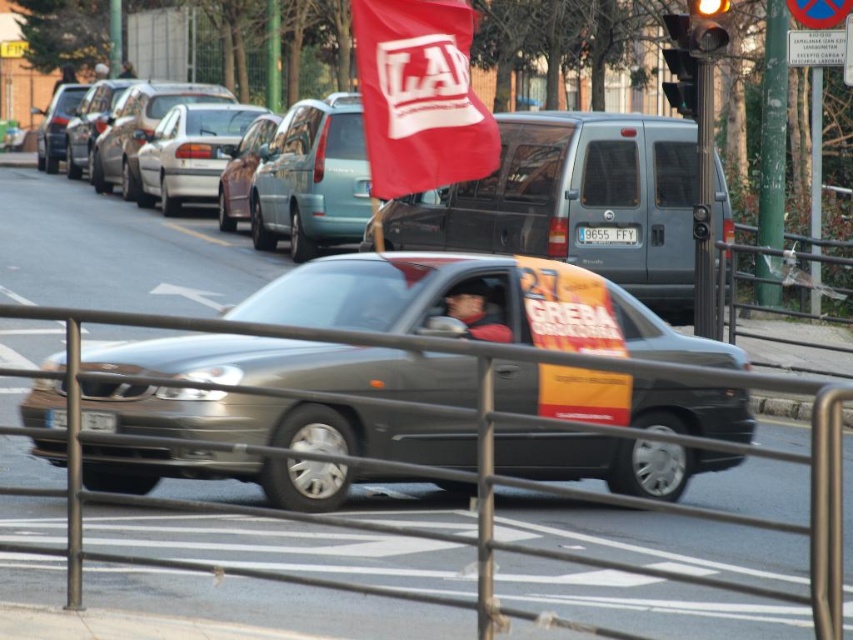
Consider the image. You are a pedestrian standing at point (225, 147) and want to cross the street. There is a car moving towards you from point (151, 381). Is the car approaching you from in front or behind?

Point (151, 381) is in front of point (225, 147), so the car is approaching from in front.

You are a pedestrian standing on the sidewalk and see the metallic silver sedan at center and the matte black shirt at center. Which object is closer to the left side of the road?

The metallic silver sedan at center is to the left of the matte black shirt at center, so the metallic silver sedan at center is closer to the left side of the road.